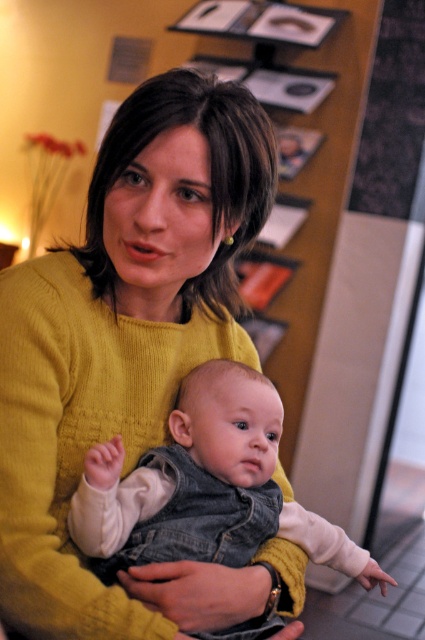
Question: Is yellow knitted sweater at center behind denim vest at center?

Choices:
 (A) yes
 (B) no

Answer: (B)

Question: Which point is closer to the camera taking this photo?

Choices:
 (A) (241, 339)
 (B) (229, 394)

Answer: (B)

Question: Which of the following is the farthest from the observer?

Choices:
 (A) (234, 614)
 (B) (258, 465)

Answer: (B)

Question: Can you confirm if yellow knitted sweater at center is smaller than denim vest at center?

Choices:
 (A) no
 (B) yes

Answer: (A)

Question: Can you confirm if yellow knitted sweater at center is positioned to the right of denim vest at center?

Choices:
 (A) yes
 (B) no

Answer: (B)